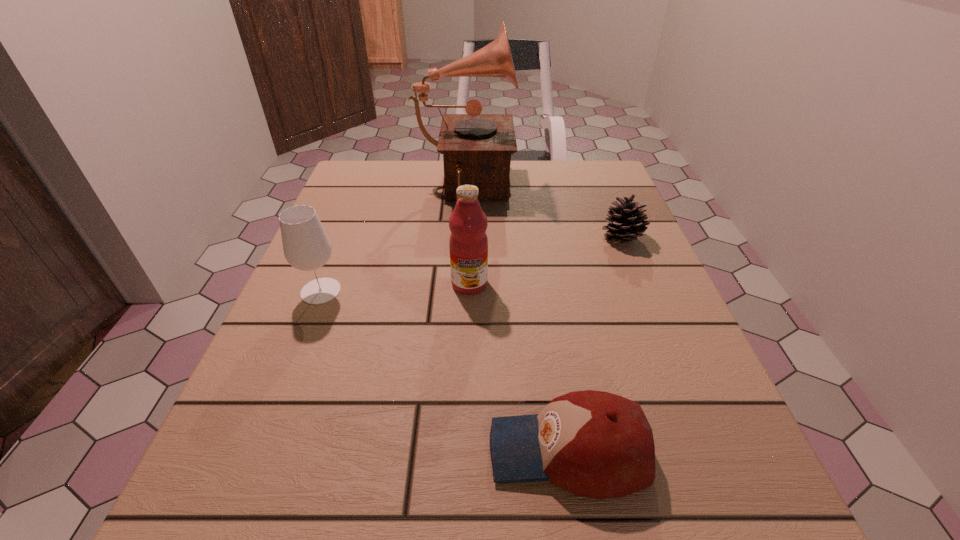
Locate an element on the screen. vacant point located on the front-facing side of the baseball cap is located at coordinates (251, 451).

Image resolution: width=960 pixels, height=540 pixels. I want to click on free space located on the front-facing side of the baseball cap, so click(417, 451).

Where is `blank space located on the front-facing side of the baseball cap`? Image resolution: width=960 pixels, height=540 pixels. blank space located on the front-facing side of the baseball cap is located at coordinates (338, 451).

Find the location of a particular element. object located in the far edge section of the desktop is located at coordinates (476, 148).

You are a GUI agent. You are given a task and a screenshot of the screen. Output one action in this format:
    pyautogui.click(x=<x>, y=<y>)
    Task: Click on the object positioned at the near edge
    
    Given the screenshot: What is the action you would take?
    pyautogui.click(x=595, y=444)

Locate an element on the screen. object located at the left edge is located at coordinates (306, 246).

At what (x,y) coordinates should I click in order to perform the action: click on pinecone located in the right edge section of the desktop. Please return your answer as a coordinate pair (x, y). Looking at the image, I should click on 626,221.

Where is `baseball cap that is at the right edge`? baseball cap that is at the right edge is located at coordinates (595, 444).

At what (x,y) coordinates should I click in order to perform the action: click on object that is at the near right corner. Please return your answer as a coordinate pair (x, y). Looking at the image, I should click on (595, 444).

Locate an element on the screen. The height and width of the screenshot is (540, 960). free space at the far edge is located at coordinates (538, 162).